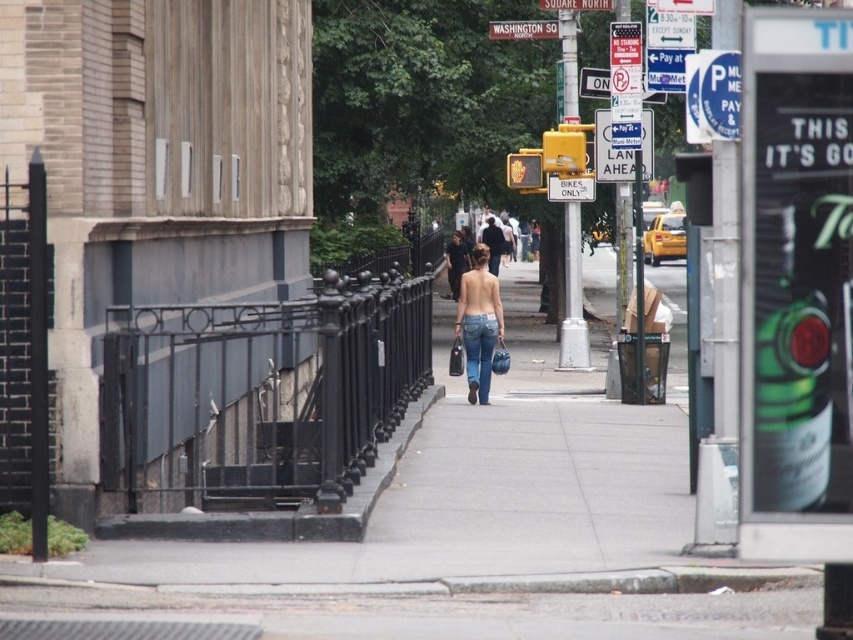
Question: Which point is farther to the camera?

Choices:
 (A) blue denim jeans at center
 (B) white plastic street sign at upper center
 (C) red wooden sign at upper center
 (D) dark brown leather jacket at center

Answer: (C)

Question: Considering the relative positions of jeans at center and red wooden sign at upper center in the image provided, where is jeans at center located with respect to red wooden sign at upper center?

Choices:
 (A) below
 (B) above

Answer: (A)

Question: Based on their relative distances, which object is nearer to the matte black tank top at center?

Choices:
 (A) white plastic street sign at upper center
 (B) red wooden sign at upper center
 (C) dark brown leather jacket at center
 (D) jeans at center

Answer: (C)

Question: Is matte black tank top at center bigger than dark brown leather jacket at center?

Choices:
 (A) no
 (B) yes

Answer: (A)

Question: Is blue denim jeans at center wider than dark brown leather jacket at center?

Choices:
 (A) yes
 (B) no

Answer: (B)

Question: Based on their relative distances, which object is nearer to the red wooden sign at upper center?

Choices:
 (A) white plastic street sign at upper center
 (B) matte black tank top at center
 (C) blue denim jeans at center

Answer: (A)